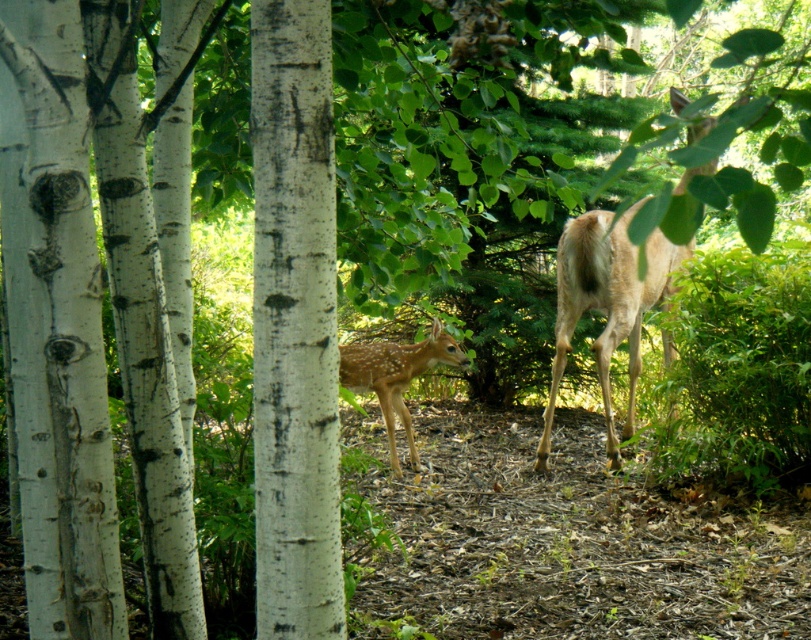
Does light brown fur at right appear over fawn fur at center?

Indeed, light brown fur at right is positioned over fawn fur at center.

Is light brown fur at right further to the viewer compared to fawn fur at center?

Yes, light brown fur at right is behind fawn fur at center.

What are the coordinates of `light brown fur at right` in the screenshot? It's located at (607, 304).

I want to click on light brown fur at right, so click(x=607, y=304).